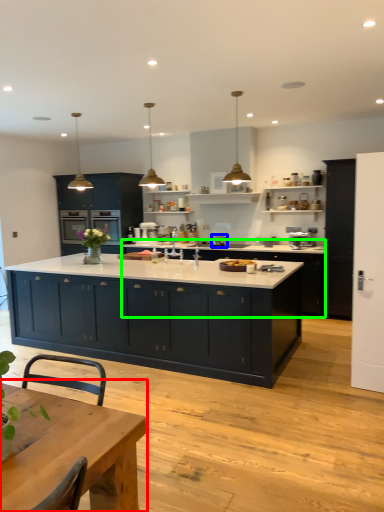
Question: Considering the real-world distances, which object is farthest from table (highlighted by a red box)? kitchen appliance (highlighted by a blue box) or cabinetry (highlighted by a green box)?

Choices:
 (A) kitchen appliance
 (B) cabinetry

Answer: (A)